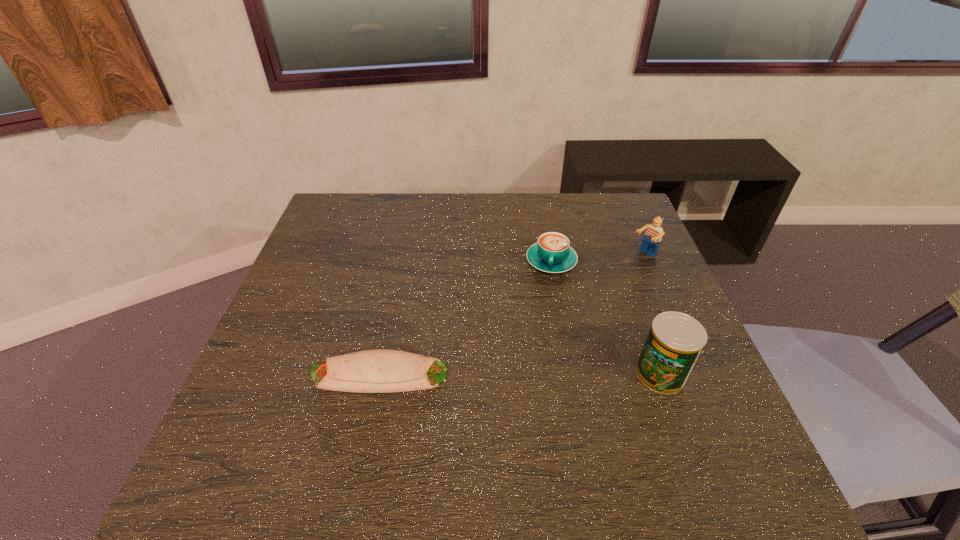
Image resolution: width=960 pixels, height=540 pixels. What are the coordinates of `vacant area between the tallest object and the shortest object` in the screenshot? It's located at (519, 374).

I want to click on free area in between the shortest object and the Lego, so click(x=512, y=315).

Image resolution: width=960 pixels, height=540 pixels. In order to click on free space between the tallest object and the shortest object in this screenshot , I will do `click(519, 374)`.

Locate an element on the screen. The image size is (960, 540). empty space that is in between the can and the second tallest object is located at coordinates (652, 314).

This screenshot has height=540, width=960. What are the coordinates of `object that stands as the closest to the second tallest object` in the screenshot? It's located at (552, 253).

Identify which object is located as the nearest to the third shortest object. Please provide its 2D coordinates. Your answer should be formatted as a tuple, i.e. [(x, y)], where the tuple contains the x and y coordinates of a point satisfying the conditions above.

[(552, 253)]

Identify the location of blank area in the image that satisfies the following two spatial constraints: 1. on the back side of the second shortest object; 2. on the left side of the Lego. The height and width of the screenshot is (540, 960). (550, 255).

The image size is (960, 540). I want to click on free space that satisfies the following two spatial constraints: 1. on the back side of the third object from right to left; 2. on the right side of the Lego, so click(x=550, y=255).